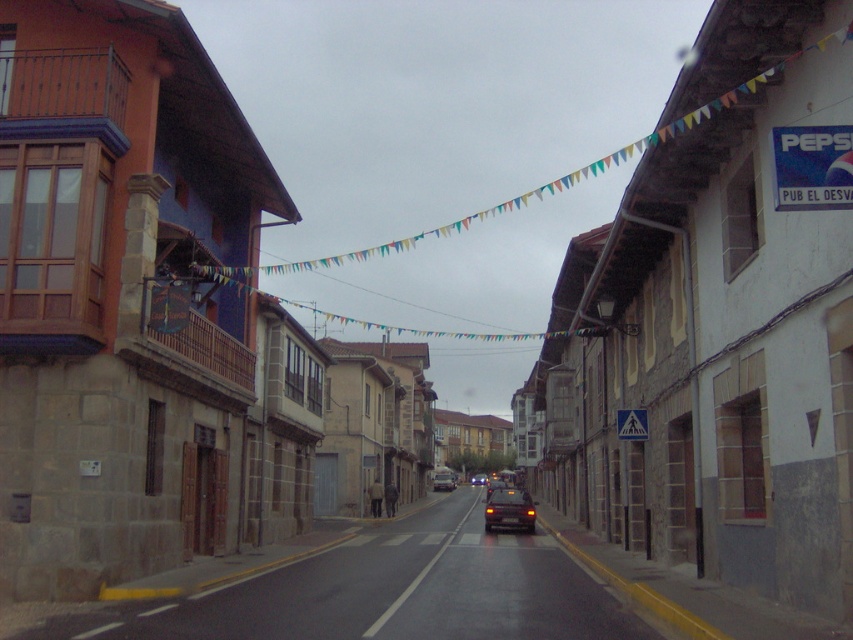
Is point (498, 480) in front of point (483, 483)?

That is True.

Which is in front, point (498, 477) or point (479, 477)?

Positioned in front is point (498, 477).

Does point (502, 486) come closer to viewer compared to point (474, 477)?

Yes.

Locate an element on the screen. This screenshot has width=853, height=640. shiny red car at center is located at coordinates click(x=494, y=484).

Does metallic silver car at center appear under shiny black sedan at center?

No.

Is point (442, 472) closer to viewer compared to point (474, 484)?

Yes, it is in front of point (474, 484).

Locate an element on the screen. Image resolution: width=853 pixels, height=640 pixels. metallic silver car at center is located at coordinates (444, 480).

Between shiny dark red car at center and metallic silver car at center, which one is positioned higher?

shiny dark red car at center is above.

Is point (531, 528) behind point (439, 474)?

No, it is not.

What do you see at coordinates (509, 509) in the screenshot? The image size is (853, 640). I see `shiny dark red car at center` at bounding box center [509, 509].

Locate an element on the screen. shiny dark red car at center is located at coordinates (509, 509).